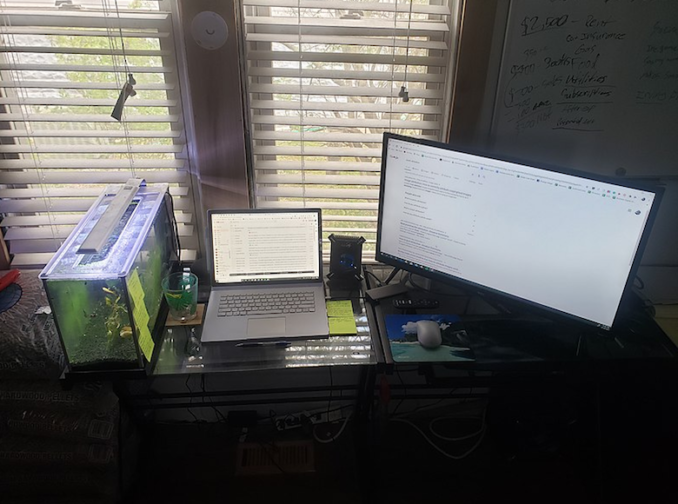
Provide coordinates for each post it note instance in the image. Your answer should be formatted as a list of tuples, i.e. [(x1, y1), (x2, y2), ...], where each tuple contains the x and y coordinates of a point satisfying the conditions above.

[(344, 322), (340, 307), (146, 342), (137, 323), (131, 292)]